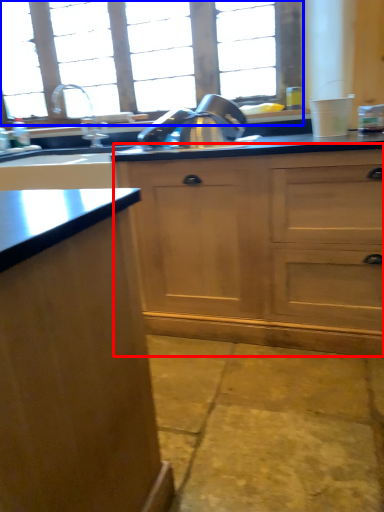
Question: Which object appears farthest to the camera in this image, dresser (highlighted by a red box) or window (highlighted by a blue box)?

Choices:
 (A) dresser
 (B) window

Answer: (B)